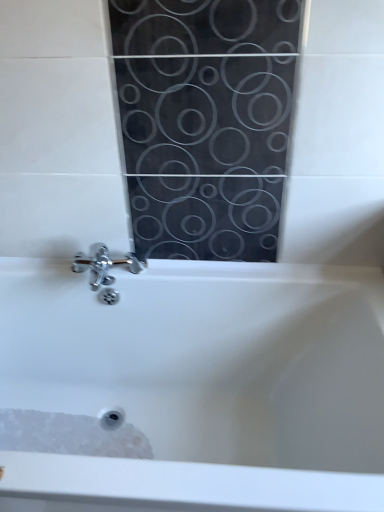
Find the location of a particular element. white glossy bathtub at center is located at coordinates (204, 381).

This screenshot has width=384, height=512. What do you see at coordinates (204, 381) in the screenshot?
I see `white glossy bathtub at center` at bounding box center [204, 381].

The image size is (384, 512). Describe the element at coordinates (71, 434) in the screenshot. I see `white textured foam at bottom left` at that location.

The height and width of the screenshot is (512, 384). Find the location of `white textured foam at bottom left`. white textured foam at bottom left is located at coordinates (71, 434).

You are a GUI agent. You are given a task and a screenshot of the screen. Output one action in this format:
    pyautogui.click(x=<x>, y=<y>)
    Task: Click on the white glossy bathtub at center
    
    Given the screenshot: What is the action you would take?
    pyautogui.click(x=204, y=381)

Can you confirm if white textured foam at bottom left is positioned to the right of white glossy bathtub at center?

No, white textured foam at bottom left is not to the right of white glossy bathtub at center.

Is white textured foam at bottom left closer to camera compared to white glossy bathtub at center?

That is False.

Is point (84, 441) more distant than point (206, 413)?

No, (84, 441) is closer to viewer.

From the image's perspective, is white textured foam at bottom left above white glossy bathtub at center?

Actually, white textured foam at bottom left appears below white glossy bathtub at center in the image.

From a real-world perspective, which object rests below the other?

white textured foam at bottom left, from a real-world perspective.

Which of these two, white textured foam at bottom left or white glossy bathtub at center, is wider?

Wider between the two is white glossy bathtub at center.

Who is shorter, white textured foam at bottom left or white glossy bathtub at center?

white textured foam at bottom left is shorter.

Who is smaller, white textured foam at bottom left or white glossy bathtub at center?

Smaller between the two is white textured foam at bottom left.

Is white textured foam at bottom left inside or outside of white glossy bathtub at center?

white textured foam at bottom left exists entirely within white glossy bathtub at center.

Is white textured foam at bottom left beside white glossy bathtub at center?

No, white textured foam at bottom left is not touching white glossy bathtub at center.

Is white textured foam at bottom left turned away from white glossy bathtub at center?

Yes, white textured foam at bottom left is facing away from white glossy bathtub at center.

How different are the orientations of white textured foam at bottom left and white glossy bathtub at center in degrees?

The angular difference between white textured foam at bottom left and white glossy bathtub at center is 1.05 degrees.

Locate an element on the screen. Image resolution: width=384 pixels, height=512 pixels. bathtub on the right of white textured foam at bottom left is located at coordinates (204, 381).

Consider the image. Is white glossy bathtub at center to the left or to the right of white textured foam at bottom left in the image?

In the image, white glossy bathtub at center appears on the right side of white textured foam at bottom left.

Is white glossy bathtub at center in front of white textured foam at bottom left?

Yes, it is in front of white textured foam at bottom left.

Is point (337, 476) positioned in front of point (122, 441)?

That is True.

From the image's perspective, is white glossy bathtub at center above or below white textured foam at bottom left?

white glossy bathtub at center is situated higher than white textured foam at bottom left in the image.

From a real-world perspective, who is located higher, white glossy bathtub at center or white textured foam at bottom left?

In real-world perspective, white glossy bathtub at center is above.

Consider the image. In terms of width, does white glossy bathtub at center look wider or thinner when compared to white textured foam at bottom left?

Clearly, white glossy bathtub at center has more width compared to white textured foam at bottom left.

Who is taller, white glossy bathtub at center or white textured foam at bottom left?

Standing taller between the two is white glossy bathtub at center.

Does white glossy bathtub at center have a larger size compared to white textured foam at bottom left?

Indeed, white glossy bathtub at center has a larger size compared to white textured foam at bottom left.

Would you say white glossy bathtub at center contains white textured foam at bottom left?

Indeed, white textured foam at bottom left is located within white glossy bathtub at center.

Are white glossy bathtub at center and white textured foam at bottom left far apart?

They are positioned close to each other.

Is white glossy bathtub at center facing towards white textured foam at bottom left?

Yes, white glossy bathtub at center is aimed at white textured foam at bottom left.

How different are the orientations of white glossy bathtub at center and white textured foam at bottom left in degrees?

white glossy bathtub at center and white textured foam at bottom left are facing 1.05 degrees away from each other.

This screenshot has width=384, height=512. I want to click on foam behind the white glossy bathtub at center, so click(x=71, y=434).

Locate an element on the screen. Image resolution: width=384 pixels, height=512 pixels. bathtub that appears on the right of white textured foam at bottom left is located at coordinates (204, 381).

The height and width of the screenshot is (512, 384). What are the coordinates of `foam behind the white glossy bathtub at center` in the screenshot? It's located at (71, 434).